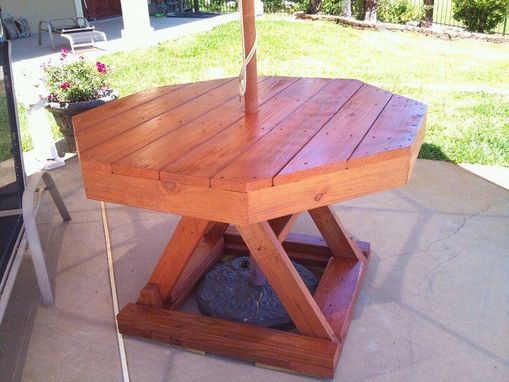
Find the location of `concrete floor`. concrete floor is located at coordinates point(401,278).